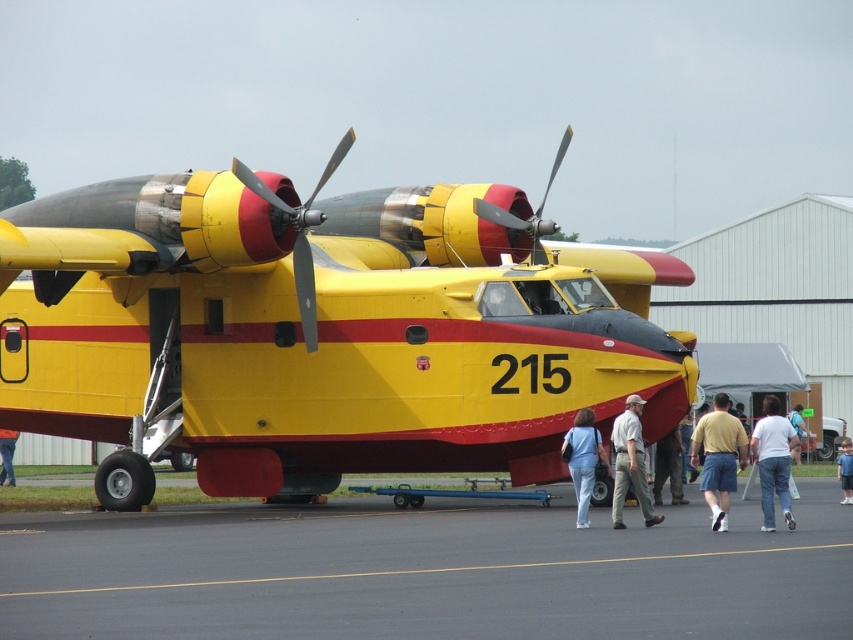
Question: Among these objects, which one is nearest to the camera?

Choices:
 (A) metallic silver propeller at center
 (B) white cotton shirt at lower right
 (C) light blue shirt at center

Answer: (B)

Question: Estimate the real-world distances between objects in this image. Which object is closer to the denim pants at lower left?

Choices:
 (A) light gray cotton shirt at center
 (B) light blue cotton shirt at center
 (C) metallic silver propeller at center
 (D) yellow matte airplane at center

Answer: (D)

Question: Does yellow matte airplane at center lie in front of metallic silver propeller at center?

Choices:
 (A) yes
 (B) no

Answer: (B)

Question: Considering the relative positions of yellow matte airplane at center and denim shorts at center in the image provided, where is yellow matte airplane at center located with respect to denim shorts at center?

Choices:
 (A) left
 (B) right

Answer: (A)

Question: Observing the image, what is the correct spatial positioning of metallic silver propeller at center in reference to light blue cotton shirt at center?

Choices:
 (A) below
 (B) above

Answer: (B)

Question: Which point is closer to the camera?

Choices:
 (A) (210, 522)
 (B) (793, 422)

Answer: (A)